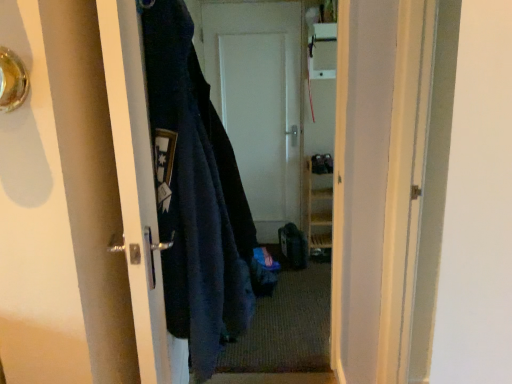
Question: Does matte black door handle at left, which is counted as the second door, starting from the back, appear on the left side of dark blue fuzzy jacket at left?

Choices:
 (A) no
 (B) yes

Answer: (B)

Question: Is matte black door handle at left, which is counted as the second door, starting from the back, positioned behind dark blue fuzzy jacket at left?

Choices:
 (A) yes
 (B) no

Answer: (B)

Question: Is matte black door handle at left, which is counted as the second door, starting from the back, surrounding dark blue fuzzy jacket at left?

Choices:
 (A) no
 (B) yes

Answer: (A)

Question: Is matte black door handle at left, the 1th door when ordered from front to back, outside dark blue fuzzy jacket at left?

Choices:
 (A) no
 (B) yes

Answer: (B)

Question: Is matte black door handle at left, the 2th door viewed from the right, turned away from dark blue fuzzy jacket at left?

Choices:
 (A) yes
 (B) no

Answer: (A)

Question: Considering the positions of matte black door handle at left, which is counted as the second door, starting from the back, and white matte door at center, the first door in the right-to-left sequence, in the image, is matte black door handle at left, which is counted as the second door, starting from the back, bigger or smaller than white matte door at center, the first door in the right-to-left sequence,?

Choices:
 (A) big
 (B) small

Answer: (A)

Question: Is point (136, 137) closer or farther from the camera than point (272, 177)?

Choices:
 (A) farther
 (B) closer

Answer: (B)

Question: Is matte black door handle at left, which is the first door from left to right, inside or outside of white matte door at center, the first door in the right-to-left sequence?

Choices:
 (A) outside
 (B) inside

Answer: (A)

Question: From the image's perspective, relative to white matte door at center, the second door from the left, is matte black door handle at left, which is counted as the second door, starting from the back, above or below?

Choices:
 (A) below
 (B) above

Answer: (A)

Question: In the image, is matte black door handle at left, which is counted as the second door, starting from the back, positioned in front of or behind carpeted mat at center?

Choices:
 (A) front
 (B) behind

Answer: (A)

Question: From a real-world perspective, relative to carpeted mat at center, is matte black door handle at left, the 1th door when ordered from front to back, vertically above or below?

Choices:
 (A) above
 (B) below

Answer: (A)

Question: From the image's perspective, is matte black door handle at left, the 2th door viewed from the right, positioned above or below carpeted mat at center?

Choices:
 (A) above
 (B) below

Answer: (A)

Question: Is matte black door handle at left, the 1th door when ordered from front to back, spatially inside carpeted mat at center, or outside of it?

Choices:
 (A) outside
 (B) inside

Answer: (A)

Question: Considering the positions of dark blue fuzzy jacket at left and white matte door at center, the first door in the right-to-left sequence, in the image, is dark blue fuzzy jacket at left bigger or smaller than white matte door at center, the first door in the right-to-left sequence,?

Choices:
 (A) big
 (B) small

Answer: (A)

Question: Would you say dark blue fuzzy jacket at left is inside or outside white matte door at center, the first door viewed from the back?

Choices:
 (A) outside
 (B) inside

Answer: (A)